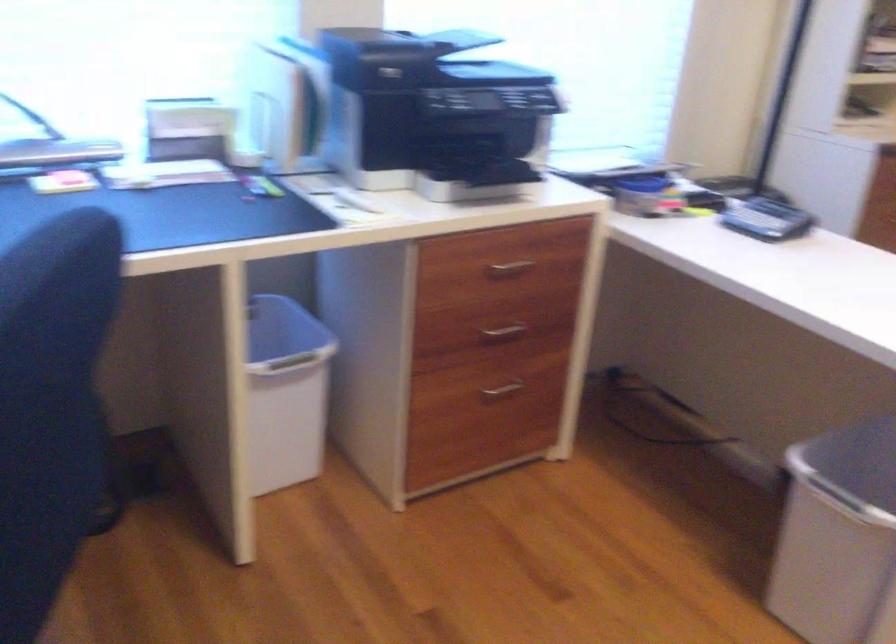
Find the location of a particular element. printer scanner lid is located at coordinates tap(462, 39).